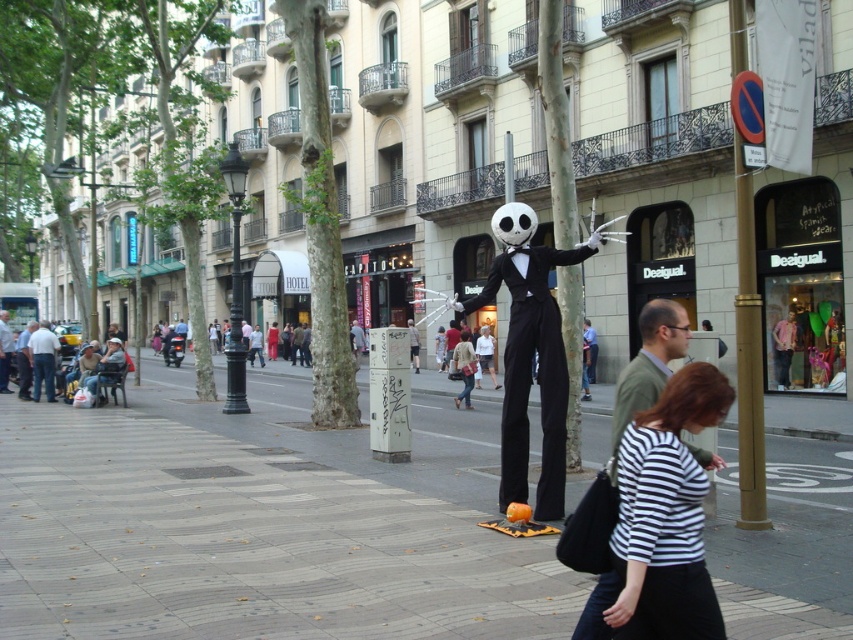
You are a photographer taking a picture of the skeleton costume figure and the tree in the urban scene. You notice two points marked as point 1 at coordinate (337, 600) and point 2 at coordinate (693, 480). Which point is closer to your camera lens?

Point 1 at coordinate (337, 600) is closer to the camera lens than point 2 at coordinate (693, 480) because it is further to the camera.

You are a delivery person carrying a box that requires a 3.5 meter clear path to move safely. You see the smooth concrete sidewalk at center and the striped fabric shirt at lower right. Is there enough space between them for your delivery path?

The smooth concrete sidewalk at center and striped fabric shirt at lower right are 4.05 meters apart, which is more than the required 3.5 meters. Therefore, there is enough space for the delivery path between them.